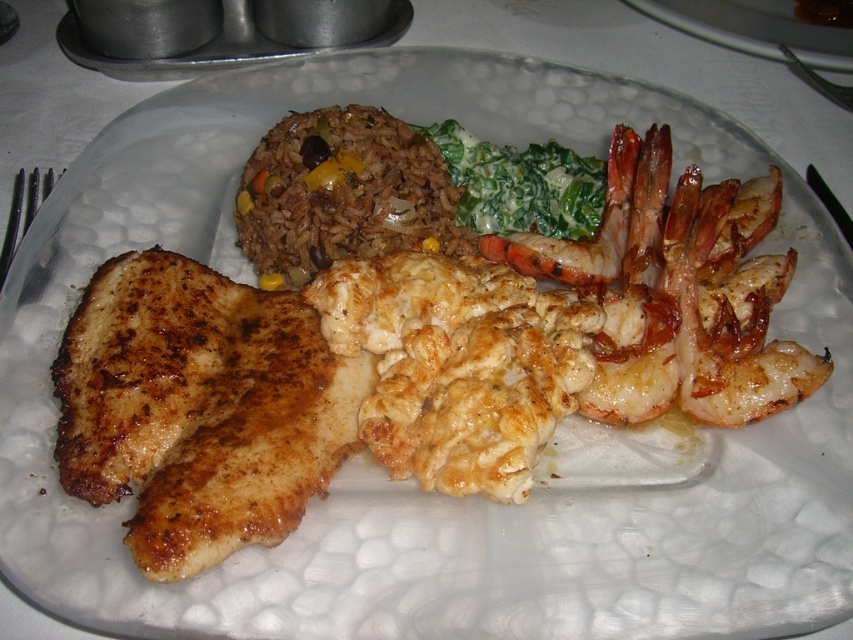
Does brown rice at center have a lesser width compared to green creamy spinach at upper center?

No.

Does point (415, 177) come behind point (509, 232)?

That is False.

Who is more distant from viewer, [363,170] or [436,132]?

Positioned behind is point [436,132].

At what (x,y) coordinates should I click in order to perform the action: click on brown rice at center. Please return your answer as a coordinate pair (x, y). This screenshot has width=853, height=640. Looking at the image, I should click on (343, 193).

Which is more to the left, brown rice at center or shiny golden shrimp at upper right?

brown rice at center is more to the left.

This screenshot has width=853, height=640. Describe the element at coordinates (343, 193) in the screenshot. I see `brown rice at center` at that location.

Does point (280, 145) come behind point (607, 221)?

No, it is not.

This screenshot has height=640, width=853. I want to click on brown rice at center, so click(343, 193).

Locate an element on the screen. green creamy spinach at upper center is located at coordinates (521, 184).

Is green creamy spinach at upper center smaller than shiny golden shrimp at upper right?

Incorrect, green creamy spinach at upper center is not smaller in size than shiny golden shrimp at upper right.

Locate an element on the screen. Image resolution: width=853 pixels, height=640 pixels. green creamy spinach at upper center is located at coordinates (521, 184).